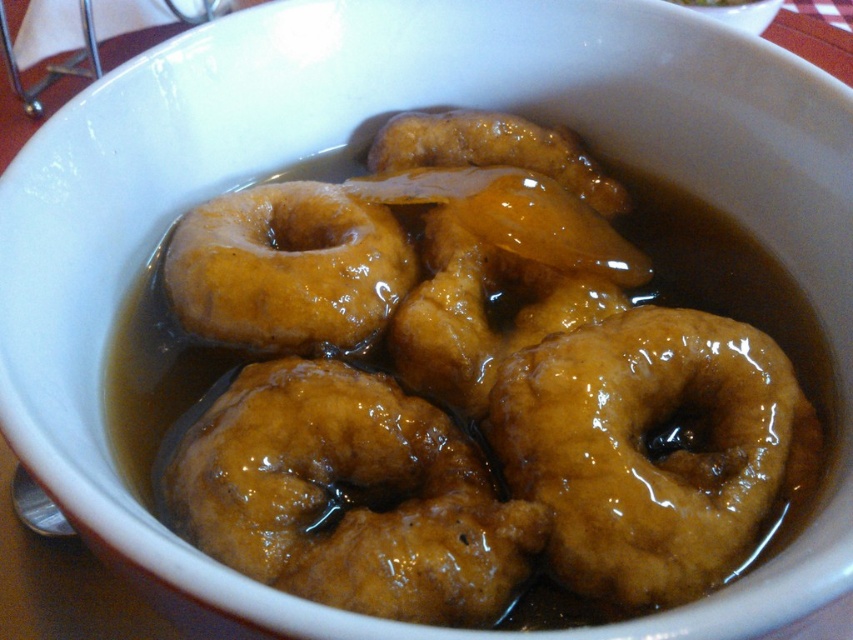
You are at a breakfast table and see two golden glazed donuts in the bowl. One is labeled as the golden brown glazed donut at center and the other as the golden glazed donut at center. Which donut is positioned lower in the bowl?

The golden brown glazed donut at center is positioned lower than the golden glazed donut at center in the bowl.

You are a customer at a diner and you want to place your napkin on the table so it doesn t get syrup from the bowl. The bowl is at point [350,497]. Where should you place your napkin to avoid the syrup?

The glossy golden donut at center is located at point [350,497], so the syrup is around that area. To avoid the syrup, place your napkin away from that point, perhaps near the edge of the table opposite to the bowl.

You are a food critic evaluating the presentation of this dessert. You notice two donuts in the bowl. Which donut has a larger diameter, the glossy golden donut at center or the golden brown glazed donut at center?

The glossy golden donut at center has a larger diameter than the golden brown glazed donut at center because its width surpasses the other.